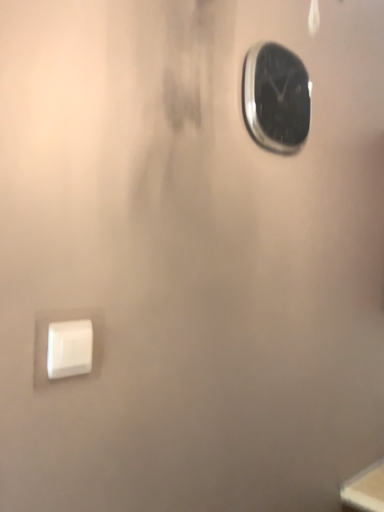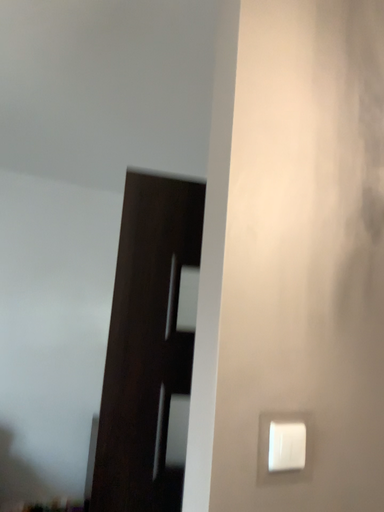
Question: How did the camera likely rotate when shooting the video?

Choices:
 (A) rotated left
 (B) rotated right

Answer: (A)